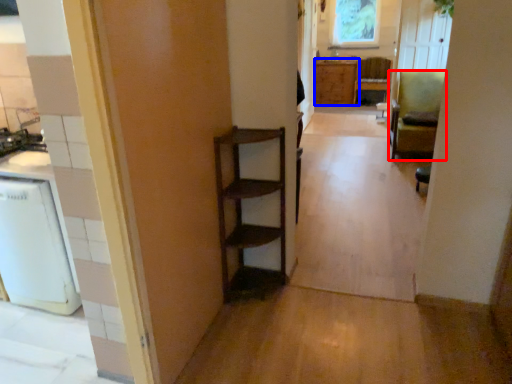
Question: Which of the following is the closest to the observer, chair (highlighted by a red box) or cabinetry (highlighted by a blue box)?

Choices:
 (A) chair
 (B) cabinetry

Answer: (A)